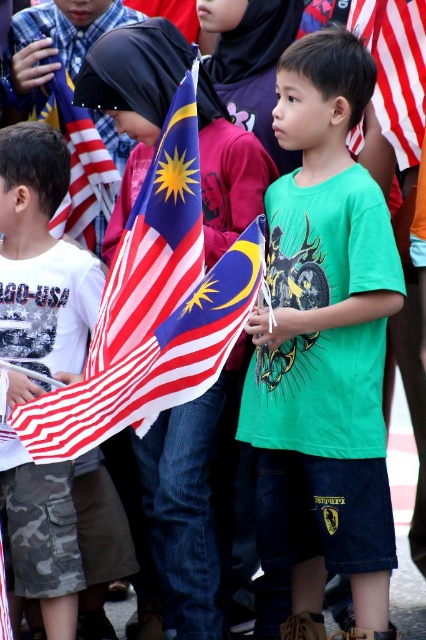
From the picture: You are a photographer trying to capture the Malaysian flag held by the boy in the green Tshirt. The camera is focused on the point at coordinates point [325,348]. Is the green matte shirt at center in focus?

The point at [325,348] is where the green matte shirt at center is located, so yes, the green matte shirt at center is in focus.

You are a photographer standing at the center of the image. There is a point marked at coordinates (40, 256). What object is located at this point?

The point at coordinates (40, 256) marks white camouflage pants at left.